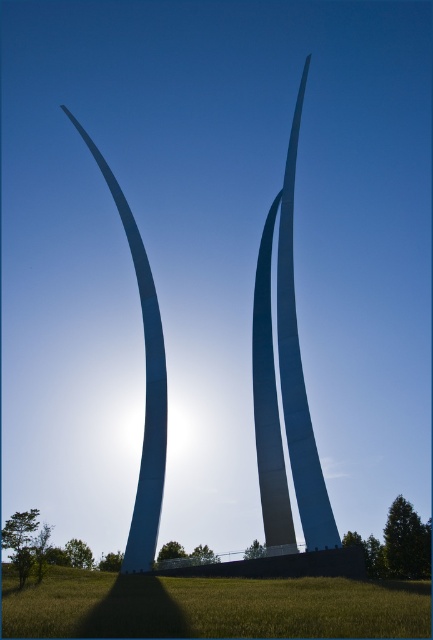
Question: Is green grass at lower center below white polished steel sculpture at left?

Choices:
 (A) yes
 (B) no

Answer: (A)

Question: In this image, where is green grass at lower center located relative to white polished steel sculpture at center?

Choices:
 (A) left
 (B) right

Answer: (A)

Question: Based on their relative distances, which object is nearer to the white polished steel sculpture at left?

Choices:
 (A) white polished steel sculpture at center
 (B) green grass at lower center

Answer: (A)

Question: Can you confirm if green grass at lower center is positioned below white polished steel sculpture at left?

Choices:
 (A) yes
 (B) no

Answer: (A)

Question: Which object is positioned farthest from the white polished steel sculpture at center?

Choices:
 (A) white polished steel sculpture at left
 (B) green grass at lower center

Answer: (B)

Question: Which object appears farthest from the camera in this image?

Choices:
 (A) white polished steel sculpture at left
 (B) green grass at lower center
 (C) white polished steel sculpture at center

Answer: (A)